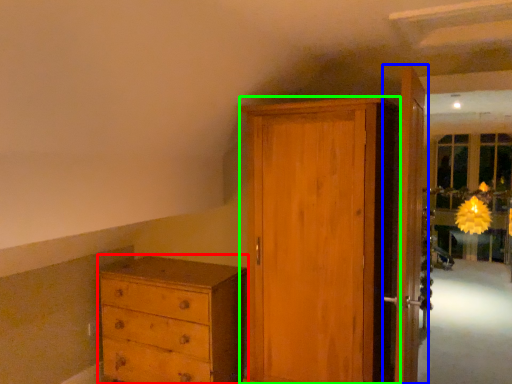
Question: Which is nearer to the chest of drawers (highlighted by a red box)? door (highlighted by a blue box) or door (highlighted by a green box).

Choices:
 (A) door
 (B) door

Answer: (B)